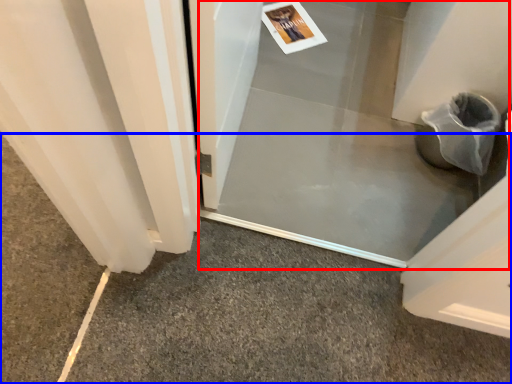
Question: Which point is closer to the camera, screen door (highlighted by a red box) or concrete (highlighted by a blue box)?

Choices:
 (A) screen door
 (B) concrete

Answer: (B)